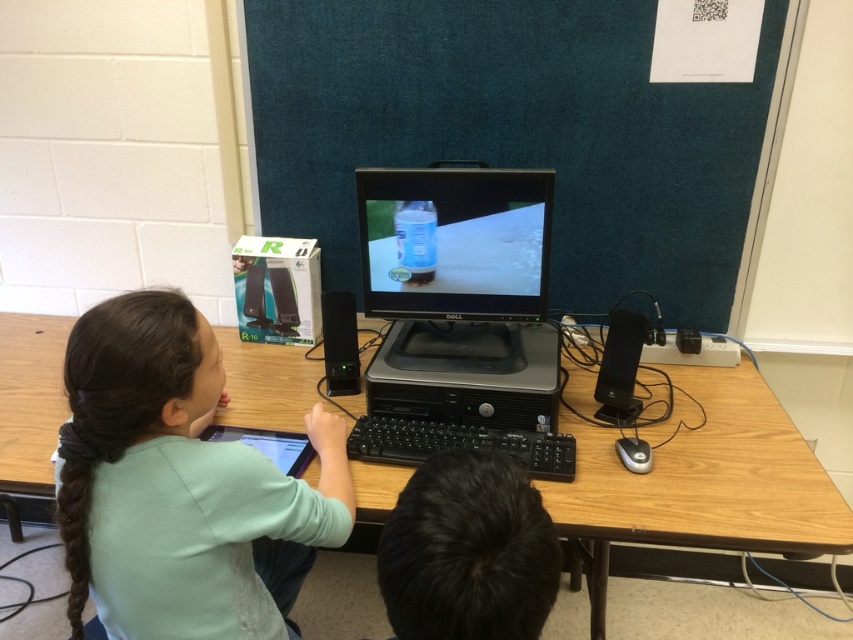
Question: Does wooden table at center appear over matte black monitor at center?

Choices:
 (A) yes
 (B) no

Answer: (B)

Question: Which object appears farthest from the camera in this image?

Choices:
 (A) black hair at center
 (B) teal fabric bulletin board at upper center
 (C) light green shirt at center
 (D) wooden table at center

Answer: (B)

Question: Estimate the real-world distances between objects in this image. Which object is farther from the wooden table at center?

Choices:
 (A) black hair at center
 (B) light green shirt at center
 (C) teal fabric bulletin board at upper center
 (D) matte black monitor at center

Answer: (B)

Question: Which point is farther to the camera?

Choices:
 (A) (457, 186)
 (B) (463, 548)
 (C) (148, 365)

Answer: (A)

Question: Can you confirm if teal fabric bulletin board at upper center is bigger than wooden table at center?

Choices:
 (A) yes
 (B) no

Answer: (A)

Question: In this image, where is light green shirt at center located relative to black hair at center?

Choices:
 (A) above
 (B) below

Answer: (B)